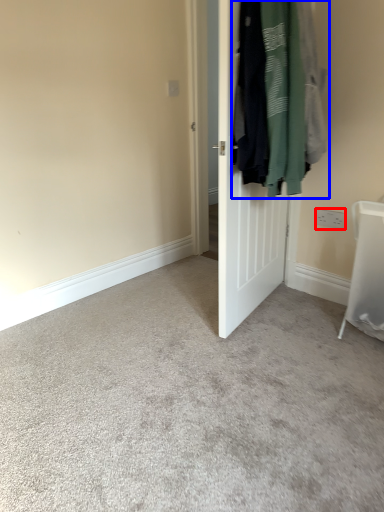
Question: Which object is further to the camera taking this photo, electric outlet (highlighted by a red box) or laundry (highlighted by a blue box)?

Choices:
 (A) electric outlet
 (B) laundry

Answer: (A)